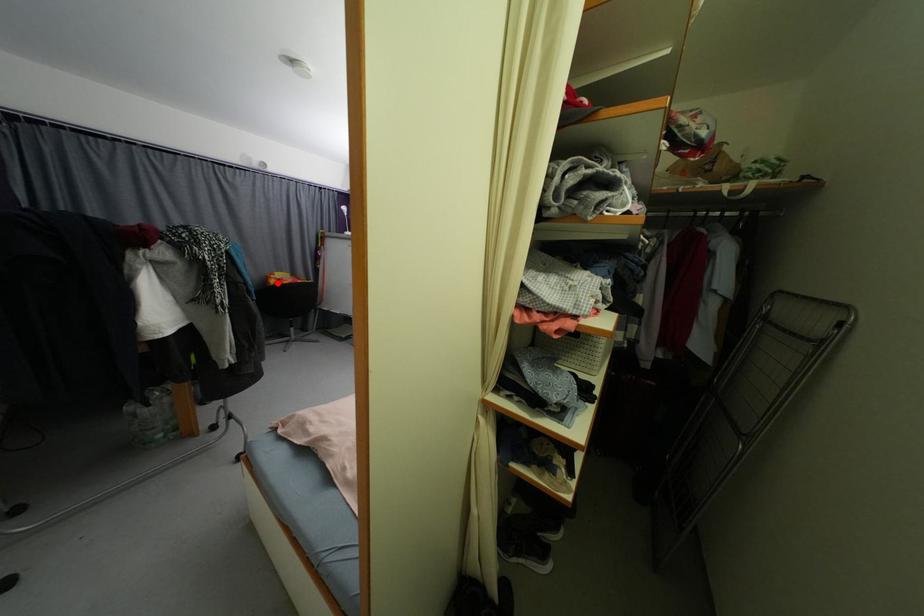
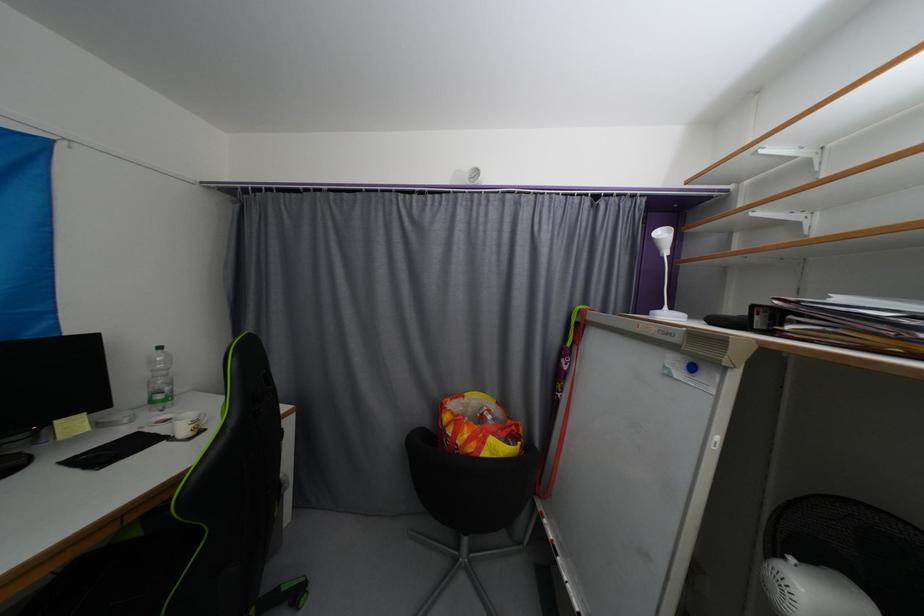
Question: I am providing you with two images of the same scene from different viewpoints. A red point is shown in image1. For the corresponding object point in image2, is it positioned nearer or farther from the camera?

Choices:
 (A) Nearer
 (B) Farther

Answer: (B)